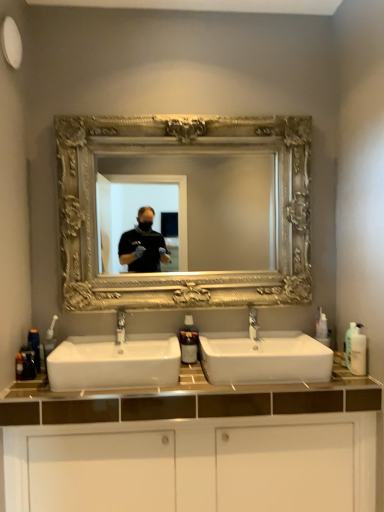
The width and height of the screenshot is (384, 512). I want to click on vacant space in front of white plastic bottle at right, arranged as the 3th toiletry when viewed from the left, so click(348, 379).